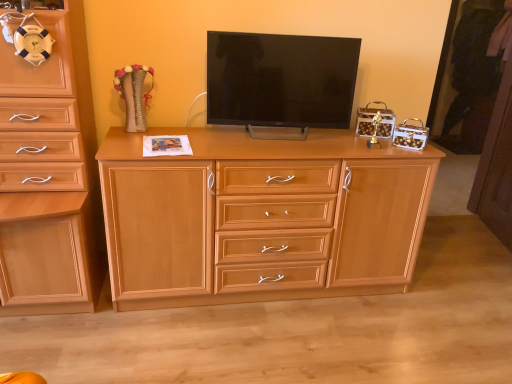
Question: Does matte black tv at center have a lesser width compared to light wood cabinet at left, arranged as the 2th chest of drawers when viewed from the right?

Choices:
 (A) no
 (B) yes

Answer: (B)

Question: Are matte black tv at center and light wood cabinet at left, the 1th chest of drawers from the left, located far from each other?

Choices:
 (A) no
 (B) yes

Answer: (A)

Question: Does matte black tv at center have a larger size compared to light wood cabinet at left, arranged as the 2th chest of drawers when viewed from the right?

Choices:
 (A) yes
 (B) no

Answer: (B)

Question: From a real-world perspective, does matte black tv at center stand above light wood cabinet at left, arranged as the 2th chest of drawers when viewed from the right?

Choices:
 (A) yes
 (B) no

Answer: (A)

Question: From a real-world perspective, is matte black tv at center beneath light wood cabinet at left, arranged as the 2th chest of drawers when viewed from the right?

Choices:
 (A) yes
 (B) no

Answer: (B)

Question: Is matte black tv at center placed right next to light wood cabinet at left, arranged as the 2th chest of drawers when viewed from the right?

Choices:
 (A) no
 (B) yes

Answer: (A)

Question: Is light wood cabinet at left, arranged as the 2th chest of drawers when viewed from the right, at the left side of matte black tv at center?

Choices:
 (A) yes
 (B) no

Answer: (A)

Question: Is light wood cabinet at left, the 1th chest of drawers from the left, positioned beyond the bounds of matte black tv at center?

Choices:
 (A) yes
 (B) no

Answer: (A)

Question: Is light wood cabinet at left, the 1th chest of drawers from the left, positioned before matte black tv at center?

Choices:
 (A) yes
 (B) no

Answer: (A)

Question: Considering the relative sizes of light wood cabinet at left, the 1th chest of drawers from the left, and matte black tv at center in the image provided, is light wood cabinet at left, the 1th chest of drawers from the left, bigger than matte black tv at center?

Choices:
 (A) yes
 (B) no

Answer: (A)

Question: Is light wood cabinet at left, arranged as the 2th chest of drawers when viewed from the right, next to matte black tv at center?

Choices:
 (A) yes
 (B) no

Answer: (B)

Question: Considering the relative sizes of light wood cabinet at left, arranged as the 2th chest of drawers when viewed from the right, and matte black tv at center in the image provided, is light wood cabinet at left, arranged as the 2th chest of drawers when viewed from the right, shorter than matte black tv at center?

Choices:
 (A) no
 (B) yes

Answer: (A)

Question: Is light wood chest of drawers at center, placed as the second chest of drawers when sorted from left to right, looking in the opposite direction of matte black tv at center?

Choices:
 (A) yes
 (B) no

Answer: (B)